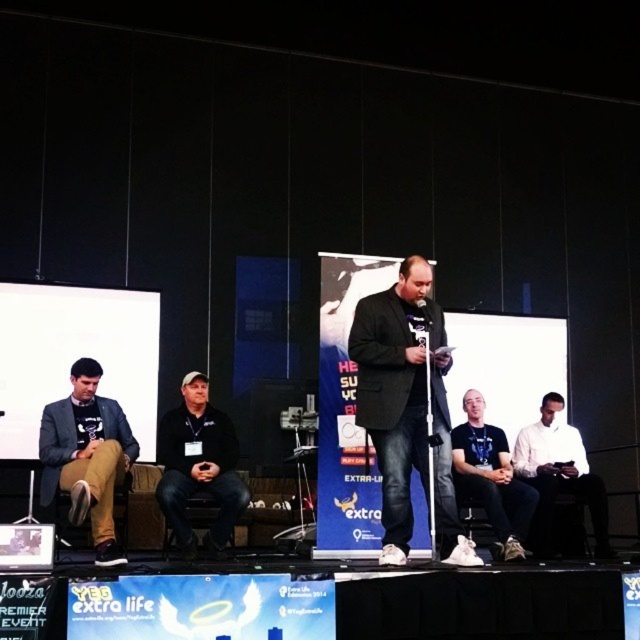
Question: Is dark gray blazer at center positioned before black fabric cap at center?

Choices:
 (A) no
 (B) yes

Answer: (B)

Question: Which point appears farthest from the camera in this image?

Choices:
 (A) (118, 424)
 (B) (516, 499)
 (C) (596, 477)

Answer: (C)

Question: Considering the relative positions of matte black jacket at left and white matte shirt at center in the image provided, where is matte black jacket at left located with respect to white matte shirt at center?

Choices:
 (A) right
 (B) left

Answer: (B)

Question: Which point is closer to the camera taking this photo?

Choices:
 (A) (483, 483)
 (B) (125, 435)
 (C) (362, 413)

Answer: (C)

Question: Among these points, which one is nearest to the camera?

Choices:
 (A) (204, 445)
 (B) (406, 540)

Answer: (B)

Question: Is matte black jacket at left below black fabric cap at center?

Choices:
 (A) no
 (B) yes

Answer: (A)